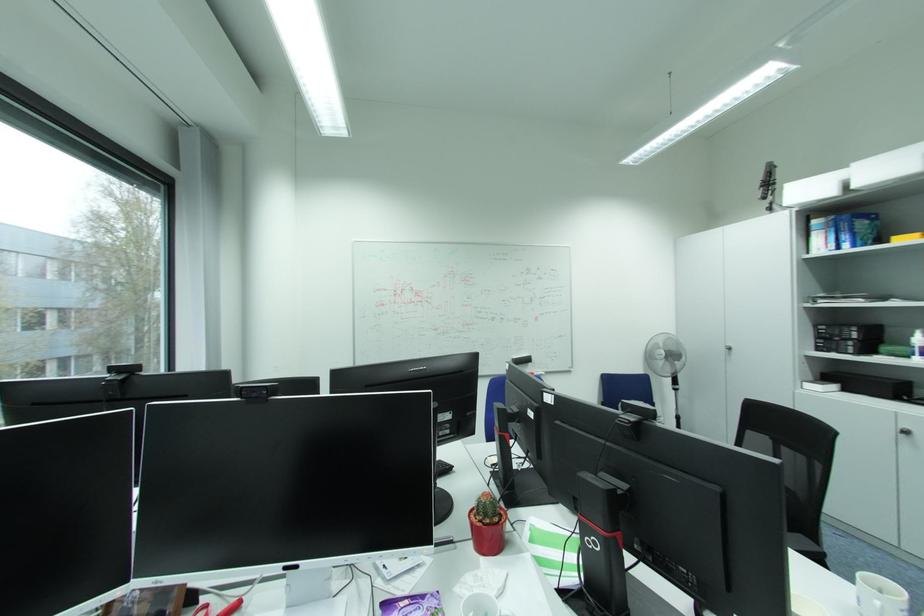
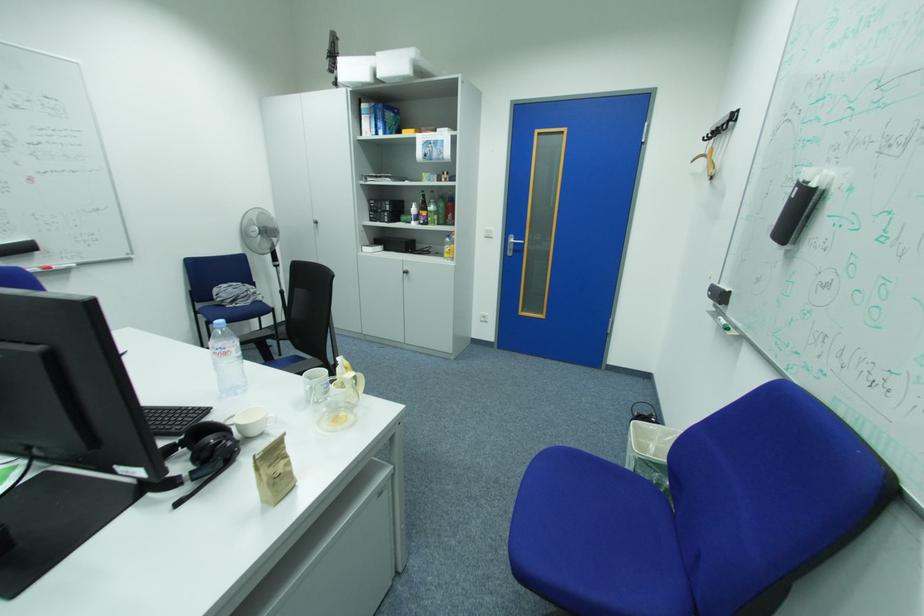
How did the camera likely rotate?

The camera's rotation is toward right-down.